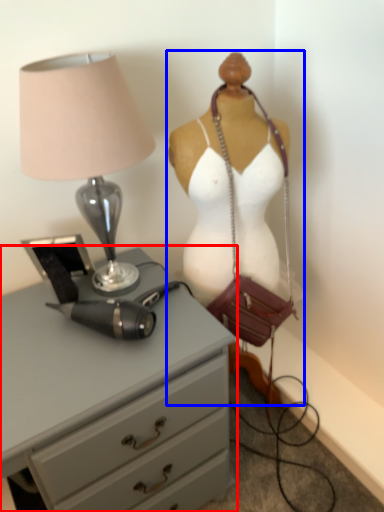
Question: Which object is closer to the camera taking this photo, chest of drawers (highlighted by a red box) or mannequin (highlighted by a blue box)?

Choices:
 (A) chest of drawers
 (B) mannequin

Answer: (A)